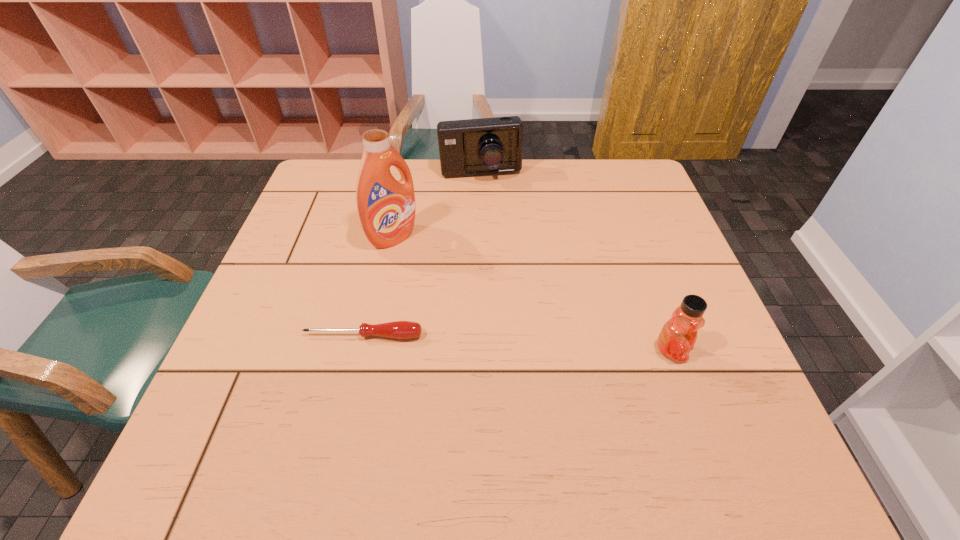
I want to click on screwdriver, so click(399, 329).

Identify the location of the rightmost object. (678, 335).

The image size is (960, 540). I want to click on the third nearest object, so click(x=386, y=207).

Locate an element on the screen. detergent is located at coordinates (386, 207).

Find the location of a particular element. This screenshot has width=960, height=540. camera is located at coordinates (x=470, y=147).

Where is `vacant space located at the tip of the shortest object`? This screenshot has width=960, height=540. vacant space located at the tip of the shortest object is located at coordinates (345, 418).

At what (x,y) coordinates should I click in order to perform the action: click on free space located on the front label of the rightmost object. Please return your answer as a coordinate pair (x, y). This screenshot has width=960, height=540. Looking at the image, I should click on (712, 350).

Where is `free point located 0.060m on the front-facing side of the tallest object`? free point located 0.060m on the front-facing side of the tallest object is located at coordinates (424, 259).

Find the location of `vacant space located on the front-facing side of the tallest object`. vacant space located on the front-facing side of the tallest object is located at coordinates (449, 276).

The image size is (960, 540). Identify the location of free region located on the front-facing side of the tallest object. click(493, 306).